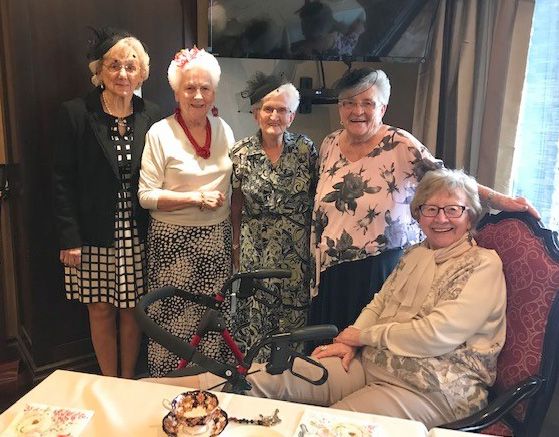
Locate an element on the screen. Image resolution: width=559 pixels, height=437 pixels. saucer is located at coordinates (229, 427).